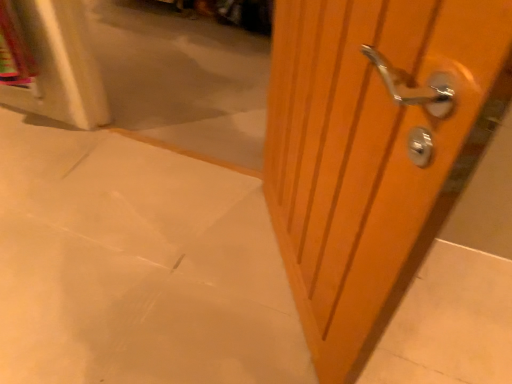
Question: Does point (326, 319) appear closer or farther from the camera than point (74, 377)?

Choices:
 (A) farther
 (B) closer

Answer: (B)

Question: Would you say wooden door handle at right is to the left or to the right of matte white concrete at center in the picture?

Choices:
 (A) left
 (B) right

Answer: (B)

Question: In terms of width, does wooden door handle at right look wider or thinner when compared to matte white concrete at center?

Choices:
 (A) wide
 (B) thin

Answer: (B)

Question: In terms of size, does matte white concrete at center appear bigger or smaller than wooden door handle at right?

Choices:
 (A) big
 (B) small

Answer: (B)

Question: Relative to wooden door handle at right, is matte white concrete at center in front or behind?

Choices:
 (A) behind
 (B) front

Answer: (A)

Question: Considering the relative positions of matte white concrete at center and wooden door handle at right in the image provided, is matte white concrete at center to the left or to the right of wooden door handle at right?

Choices:
 (A) right
 (B) left

Answer: (B)

Question: Is point (92, 291) positioned closer to the camera than point (373, 185)?

Choices:
 (A) closer
 (B) farther

Answer: (B)